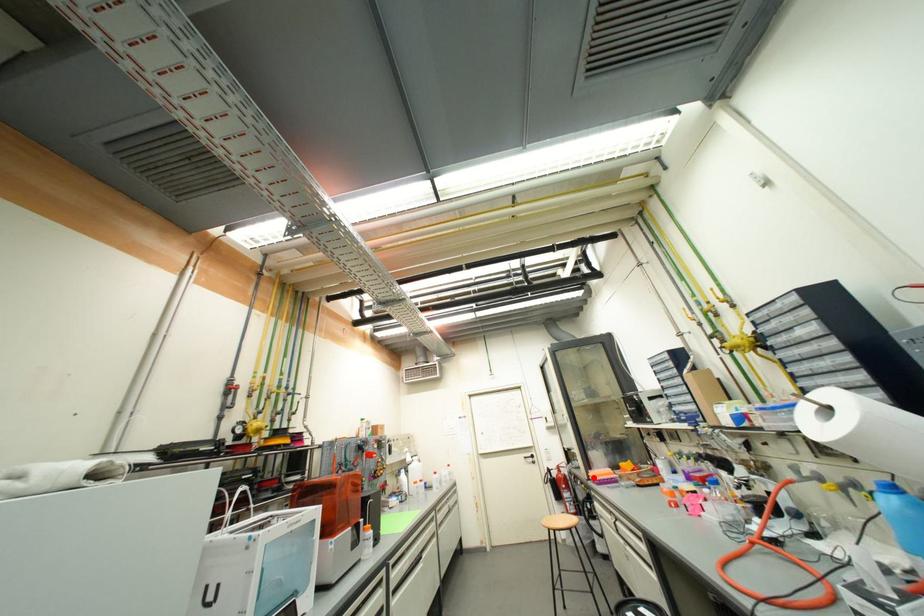
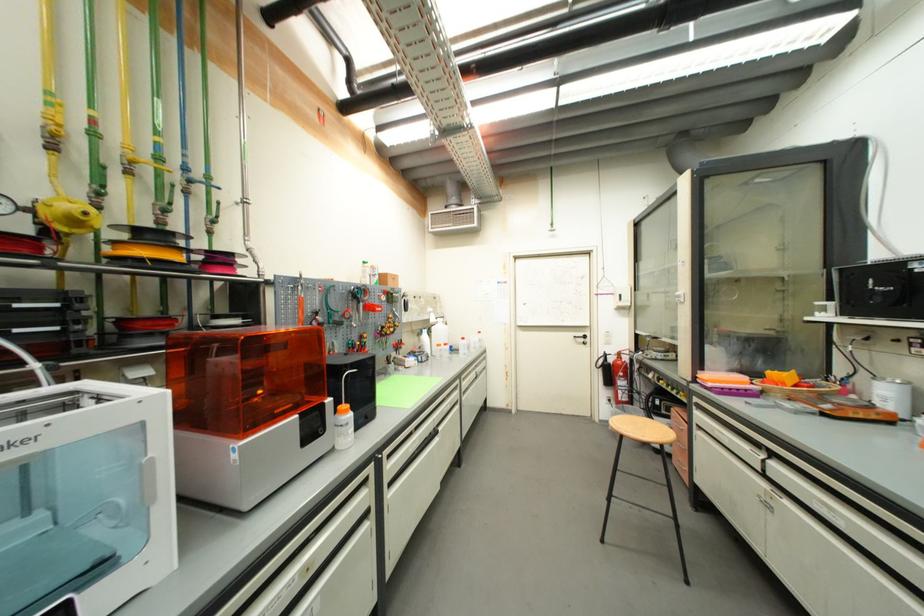
Where in the second image is the point corresponding to the highlighted location from the first image?

(699, 379)